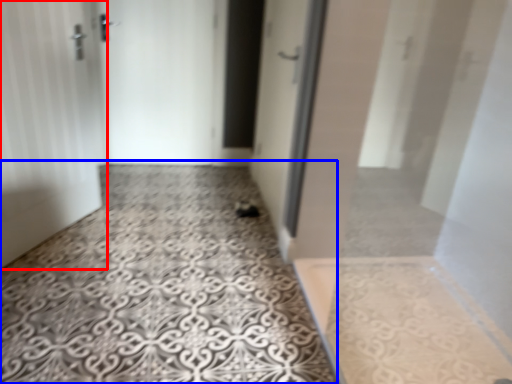
Question: Which point is further to the camera, door (highlighted by a red box) or concrete (highlighted by a blue box)?

Choices:
 (A) door
 (B) concrete

Answer: (A)